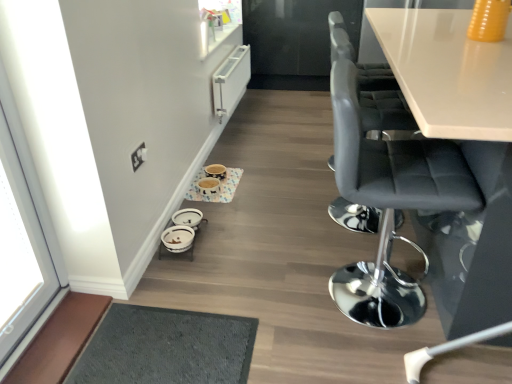
Locate an element on the screen. Image resolution: width=512 pixels, height=384 pixels. vacant area to the right of white ceramic bowls at lower center, acting as the first round table starting from the front is located at coordinates (231, 235).